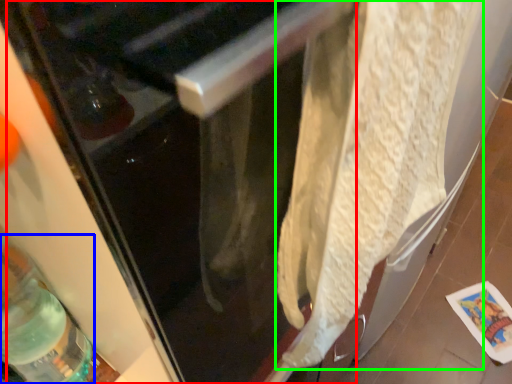
Question: Which object is the farthest from screen door (highlighted by a red box)? Choose among these: bottle (highlighted by a blue box) or wrap (highlighted by a green box).

Choices:
 (A) bottle
 (B) wrap

Answer: (A)